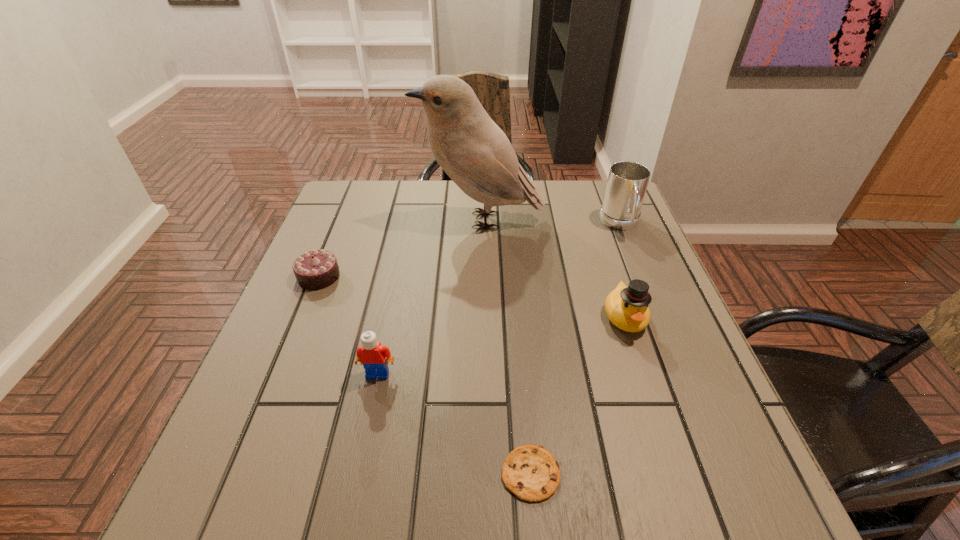
Identify the location of parakeet. This screenshot has height=540, width=960. (474, 152).

The height and width of the screenshot is (540, 960). Find the location of `the fifth shortest object`. the fifth shortest object is located at coordinates (627, 182).

At what (x,y) coordinates should I click in order to perform the action: click on Lego. Please return your answer as a coordinate pair (x, y). This screenshot has width=960, height=540. Looking at the image, I should click on (374, 357).

Find the location of a particular element. the fourth farthest object is located at coordinates pyautogui.click(x=627, y=308).

The width and height of the screenshot is (960, 540). Find the location of `the fourth nearest object`. the fourth nearest object is located at coordinates (317, 269).

Where is `the leftmost object`? This screenshot has height=540, width=960. the leftmost object is located at coordinates (317, 269).

In order to click on the nearest object in this screenshot , I will do `click(530, 471)`.

Locate an element on the screen. The width and height of the screenshot is (960, 540). cookie is located at coordinates click(x=530, y=471).

Where is `vacant space located 0.160m on the face of the parakeet`? This screenshot has height=540, width=960. vacant space located 0.160m on the face of the parakeet is located at coordinates (360, 220).

Identify the location of free space located 0.220m on the face of the parakeet. This screenshot has height=540, width=960. (338, 220).